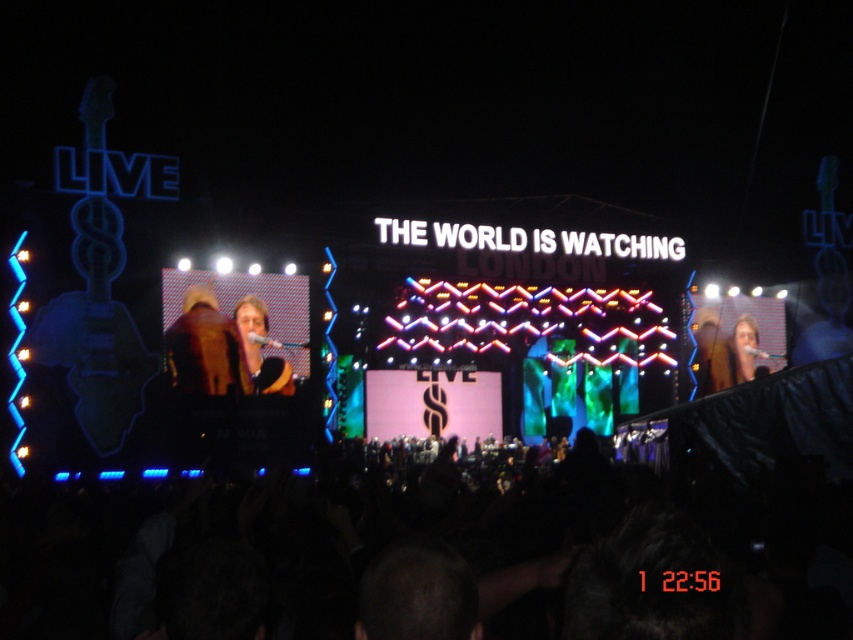
Can you confirm if brown leather jacket at center is bigger than smooth skin face at right?

No, brown leather jacket at center is not bigger than smooth skin face at right.

Between point (231, 372) and point (732, 384), which one is positioned behind?

Positioned behind is point (732, 384).

Where is `brown leather jacket at center`? brown leather jacket at center is located at coordinates (206, 348).

Between point (256, 392) and point (711, 344), which one is positioned behind?

The point (711, 344) is behind.

Can you confirm if light brown leather jacket at center is shorter than smooth skin face at right?

No, light brown leather jacket at center is not shorter than smooth skin face at right.

What do you see at coordinates (260, 348) in the screenshot? I see `light brown leather jacket at center` at bounding box center [260, 348].

Image resolution: width=853 pixels, height=640 pixels. In order to click on light brown leather jacket at center in this screenshot , I will do `click(260, 348)`.

Is brown leather jacket at center shorter than light brown leather jacket at center?

No, brown leather jacket at center is not shorter than light brown leather jacket at center.

Between point (184, 392) and point (271, 384), which one is positioned in front?

Point (184, 392) is more forward.

Where is `brown leather jacket at center`? The height and width of the screenshot is (640, 853). brown leather jacket at center is located at coordinates (206, 348).